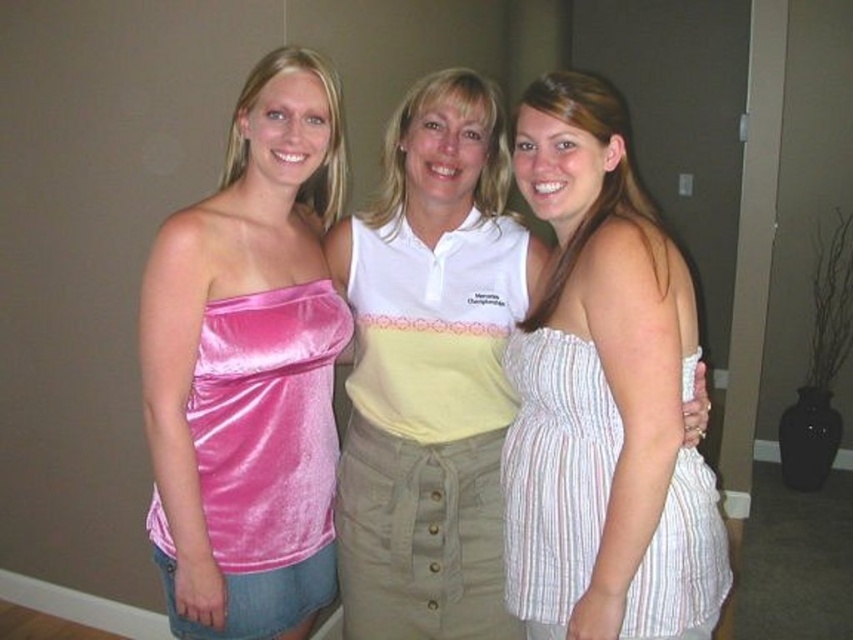
Question: Can you confirm if white striped dress at right is positioned to the left of pink velvet strapless dress at left?

Choices:
 (A) yes
 (B) no

Answer: (B)

Question: Is pink velvet top at left further to the viewer compared to pink velvet strapless dress at left?

Choices:
 (A) yes
 (B) no

Answer: (B)

Question: Which of the following is the closest to the observer?

Choices:
 (A) (407, 184)
 (B) (540, 358)

Answer: (B)

Question: Which point appears farthest from the camera in this image?

Choices:
 (A) (534, 577)
 (B) (231, 124)
 (C) (279, 296)
 (D) (454, 378)

Answer: (B)

Question: Among these objects, which one is farthest from the camera?

Choices:
 (A) white cotton shirt at center
 (B) pink velvet strapless dress at left
 (C) pink velvet top at left

Answer: (A)

Question: Is white cotton shirt at center thinner than pink velvet strapless dress at left?

Choices:
 (A) yes
 (B) no

Answer: (B)